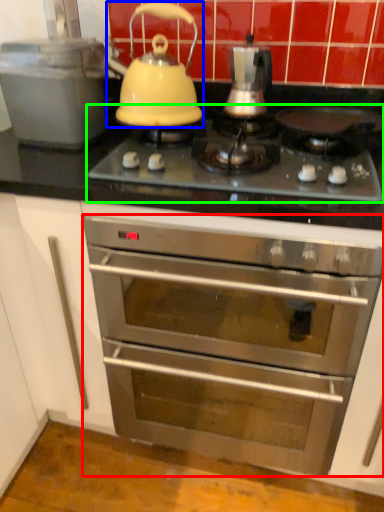
Question: Considering the real-world distances, which object is closest to oven (highlighted by a red box)? kettle (highlighted by a blue box) or gas stove (highlighted by a green box).

Choices:
 (A) kettle
 (B) gas stove

Answer: (B)